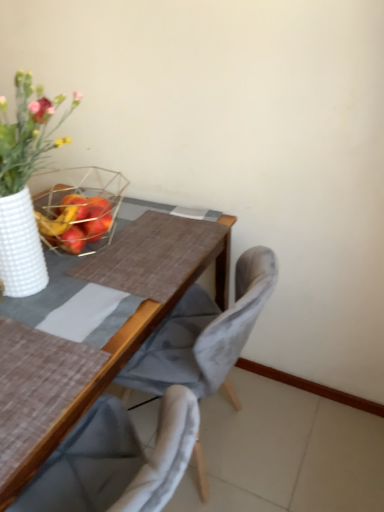
Find the location of `brown textured table at center`. brown textured table at center is located at coordinates (110, 367).

What do you see at coordinates (110, 367) in the screenshot? The width and height of the screenshot is (384, 512). I see `brown textured table at center` at bounding box center [110, 367].

At what (x,y) coordinates should I click in order to perform the action: click on brown textured table at center. Please return your answer as a coordinate pair (x, y). This screenshot has width=384, height=512. Looking at the image, I should click on click(x=110, y=367).